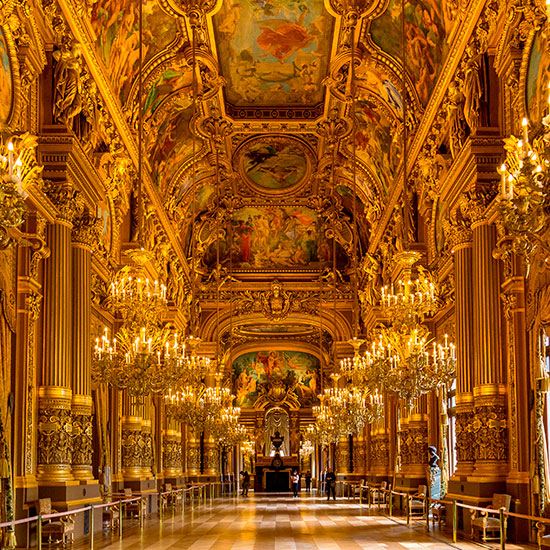
Locate an element on the screen. This screenshot has height=550, width=550. floor is located at coordinates (283, 520).